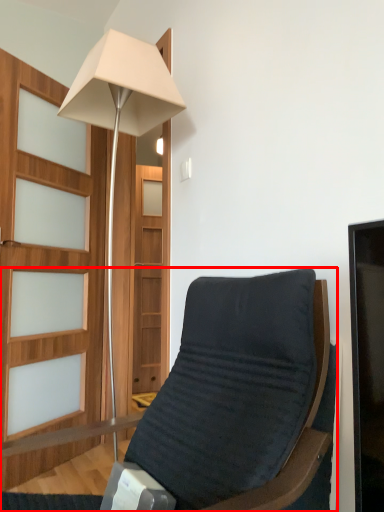
Question: From the image's perspective, what is the correct spatial relationship of chair (annotated by the red box) in relation to lamp?

Choices:
 (A) above
 (B) below

Answer: (B)